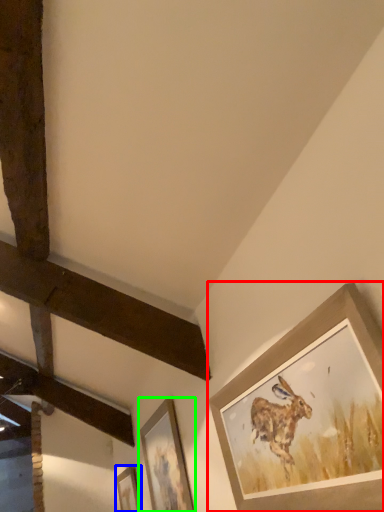
Question: Which object is the closest to the picture frame (highlighted by a red box)? Choose among these: picture frame (highlighted by a blue box) or picture frame (highlighted by a green box).

Choices:
 (A) picture frame
 (B) picture frame

Answer: (B)